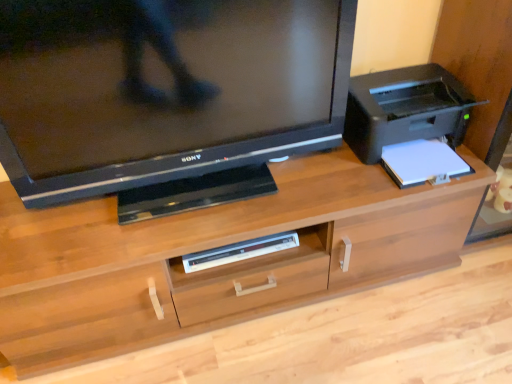
The width and height of the screenshot is (512, 384). Identify the location of free point above wooden desk at center (from a real-world perspective). (213, 198).